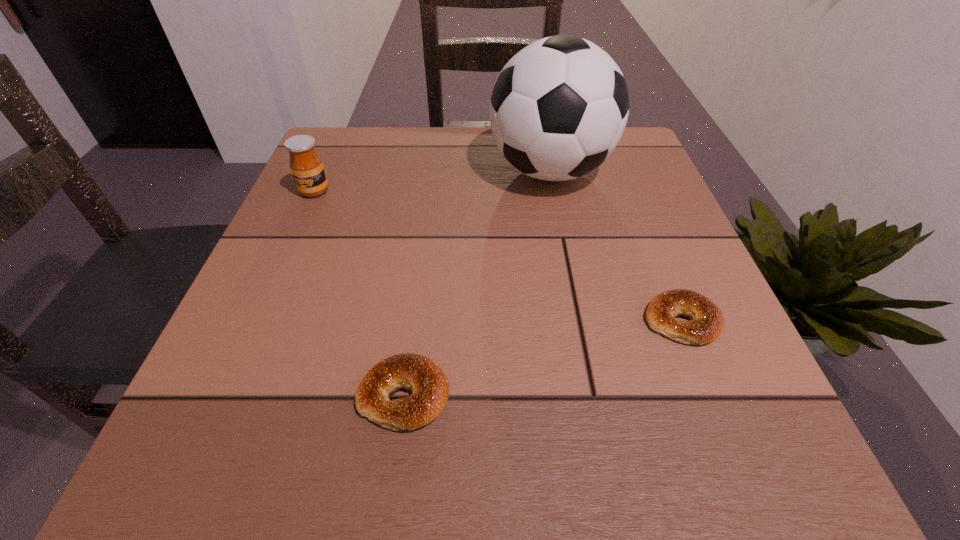
Where is `empty space that is in between the soccer ball and the farther bagel`? empty space that is in between the soccer ball and the farther bagel is located at coordinates (615, 246).

This screenshot has height=540, width=960. Find the location of `empty location between the soccer ball and the nearest object`. empty location between the soccer ball and the nearest object is located at coordinates (477, 283).

Identify the location of blank region between the farther bagel and the left bagel. (543, 358).

This screenshot has width=960, height=540. I want to click on vacant space that is in between the second nearest object and the soccer ball, so click(615, 246).

At what (x,y) coordinates should I click in order to perform the action: click on free space between the third object from right to left and the leftmost object. Please return your answer as a coordinate pair (x, y). The width and height of the screenshot is (960, 540). Looking at the image, I should click on (360, 293).

Image resolution: width=960 pixels, height=540 pixels. I want to click on free point between the soccer ball and the farther bagel, so click(615, 246).

Where is `object that is the second closest to the honey`? object that is the second closest to the honey is located at coordinates (430, 387).

Find the location of a particular element. The width and height of the screenshot is (960, 540). the closest object to the third shortest object is located at coordinates (558, 109).

The width and height of the screenshot is (960, 540). Find the location of `vacant point that satisfies the following two spatial constraints: 1. on the front-facing side of the second object from left to right; 2. on the left side of the second tallest object`. vacant point that satisfies the following two spatial constraints: 1. on the front-facing side of the second object from left to right; 2. on the left side of the second tallest object is located at coordinates [225, 395].